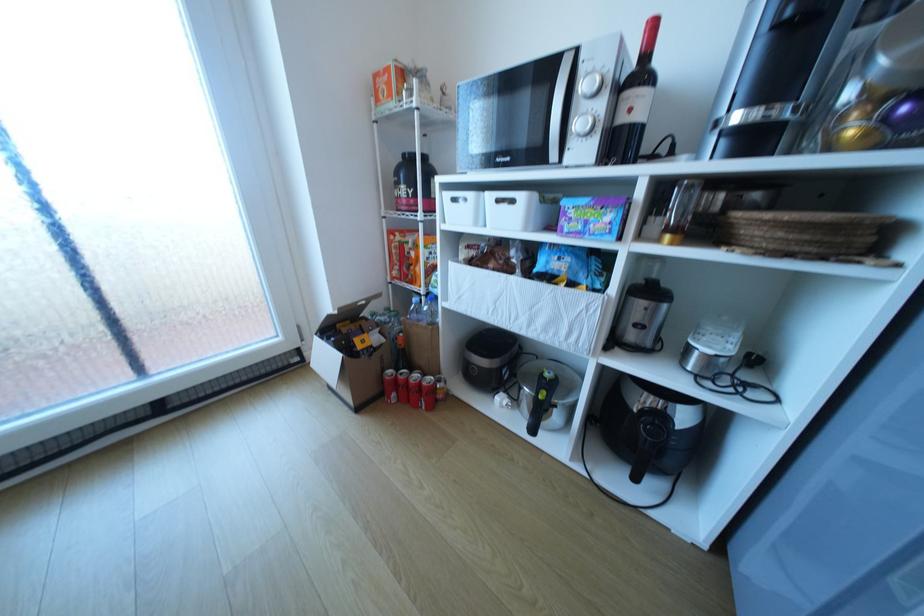
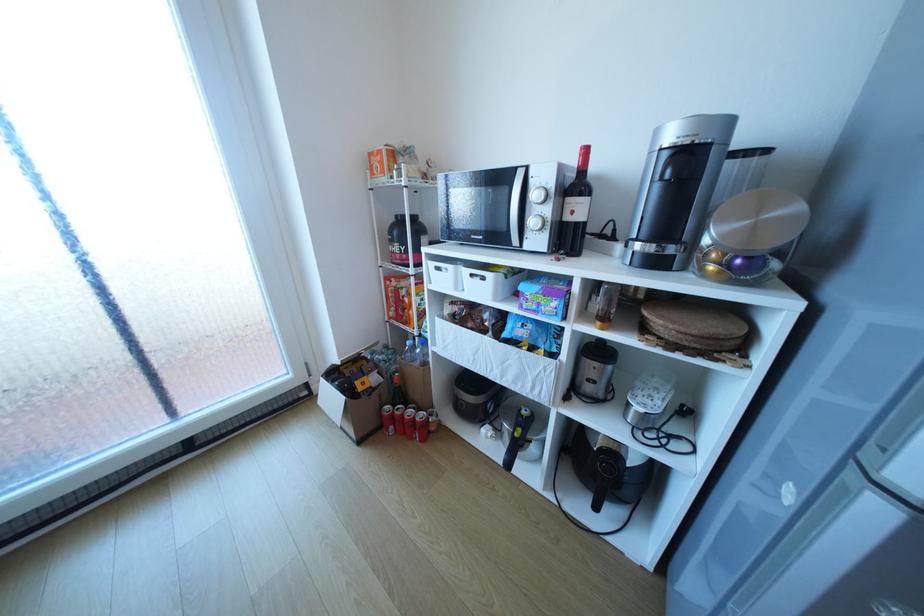
Question: I am providing you with two images of the same scene from different viewpoints. After the viewpoint changes to image2, which objects are now occluded?

Choices:
 (A) air fryer handle
 (B) microwave control dial
 (C) red soda can
 (D) none of these

Answer: (D)